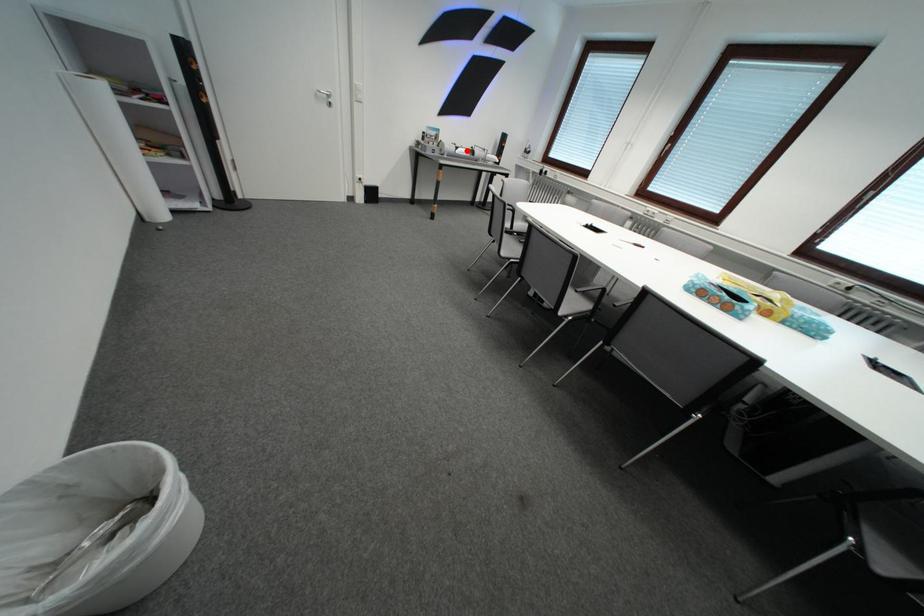
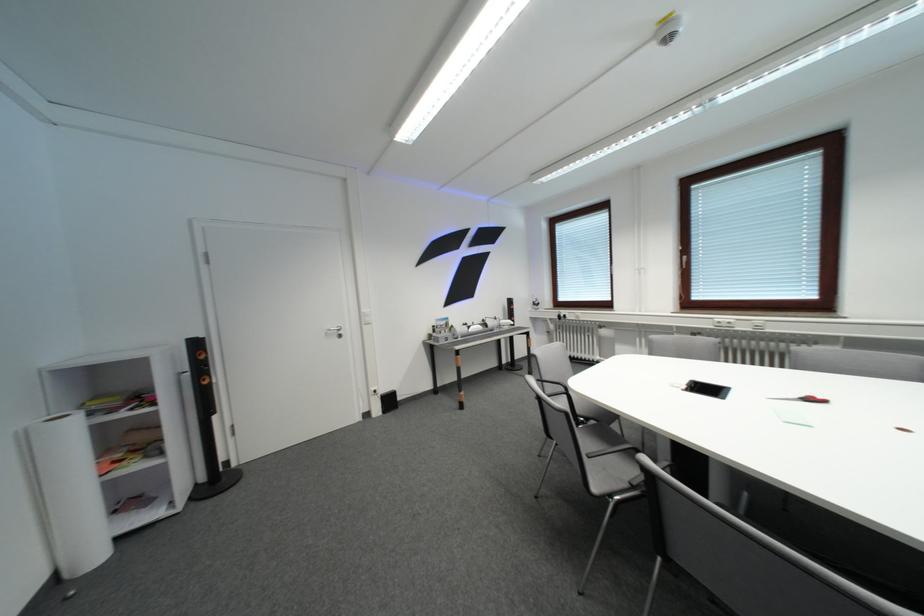
Question: I am providing you with two images of the same scene from different viewpoints. A red point is shown in image1. For the corresponding object point in image2, is it positioned nearer or farther from the camera?

Choices:
 (A) Nearer
 (B) Farther

Answer: (B)